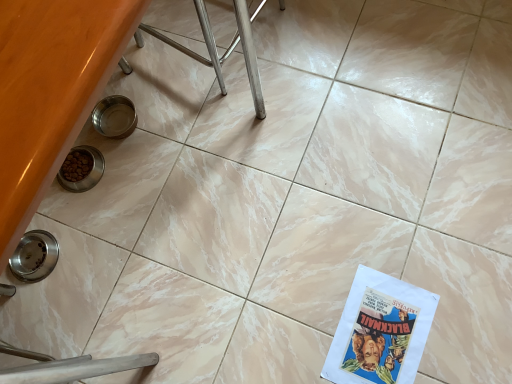
Question: Is brushed metal stool at upper center taller or shorter than matte paper comic book at lower right?

Choices:
 (A) short
 (B) tall

Answer: (B)

Question: Would you say brushed metal stool at upper center is inside or outside matte paper comic book at lower right?

Choices:
 (A) outside
 (B) inside

Answer: (A)

Question: Considering the positions of brushed metal stool at upper center and matte paper comic book at lower right in the image, is brushed metal stool at upper center bigger or smaller than matte paper comic book at lower right?

Choices:
 (A) big
 (B) small

Answer: (A)

Question: Based on their sizes in the image, would you say matte paper comic book at lower right is bigger or smaller than brushed metal stool at upper center?

Choices:
 (A) big
 (B) small

Answer: (B)

Question: Visually, is matte paper comic book at lower right positioned to the left or to the right of brushed metal stool at upper center?

Choices:
 (A) right
 (B) left

Answer: (A)

Question: From the image's perspective, is matte paper comic book at lower right located above or below brushed metal stool at upper center?

Choices:
 (A) above
 (B) below

Answer: (B)

Question: Is point (354, 316) positioned closer to the camera than point (151, 33)?

Choices:
 (A) farther
 (B) closer

Answer: (B)